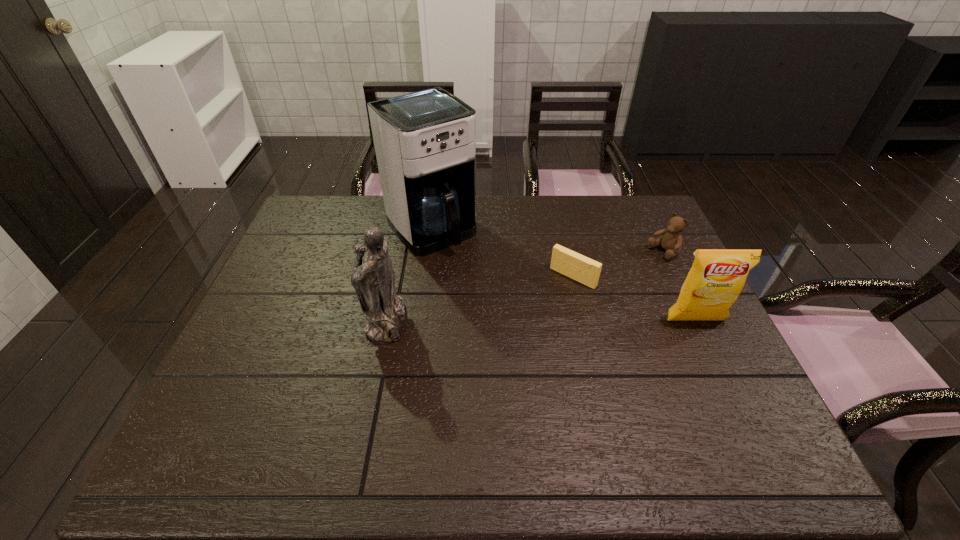
Locate an element on the screen. The width and height of the screenshot is (960, 540). figurine is located at coordinates (374, 281).

The height and width of the screenshot is (540, 960). Find the location of `crisp (potato chip)`. crisp (potato chip) is located at coordinates (717, 277).

Where is `teddy bear`? teddy bear is located at coordinates (672, 240).

At what (x,y) coordinates should I click in order to perform the action: click on videotape. Please return your answer as a coordinate pair (x, y). This screenshot has height=540, width=960. Looking at the image, I should click on (565, 261).

Image resolution: width=960 pixels, height=540 pixels. Find the location of `the shortest object`. the shortest object is located at coordinates (565, 261).

I want to click on coffee maker, so click(425, 142).

Image resolution: width=960 pixels, height=540 pixels. I want to click on vacant area situated on the front-facing side of the figurine, so click(319, 319).

The image size is (960, 540). In order to click on free location located on the front-facing side of the figurine in this screenshot , I will do `click(258, 319)`.

Image resolution: width=960 pixels, height=540 pixels. Identify the location of vacant region located on the front-facing side of the figurine. (330, 319).

Where is `vacant position located 0.150m on the front of the third tallest object with the logo`? vacant position located 0.150m on the front of the third tallest object with the logo is located at coordinates (722, 377).